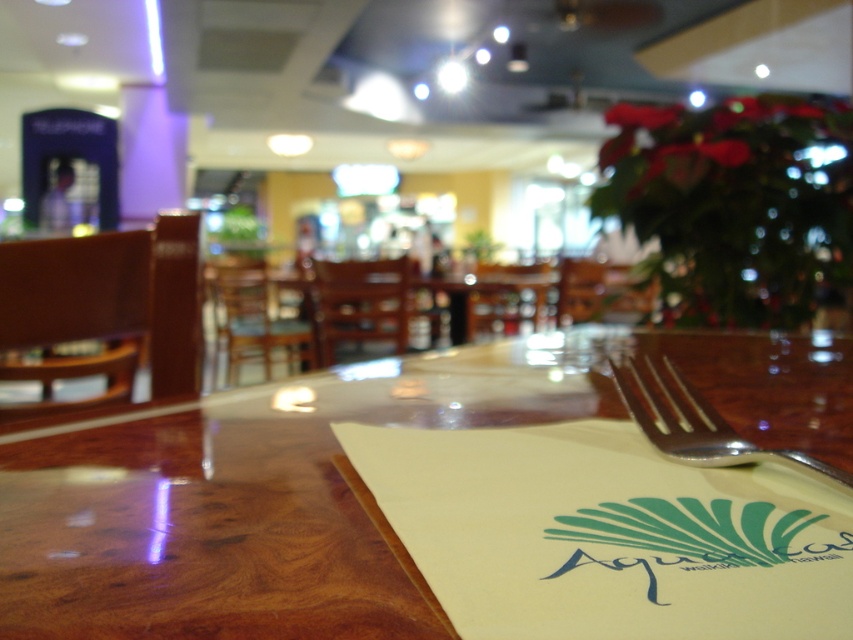
Based on the photo, you are a photographer standing at the camera position. You want to place a small decoration exactly at the point (167, 449). The decoration is 2 inches in diameter. Will it fit without overlapping any existing objects at that point?

The point (167, 449) is 18.12 inches away from the camera. Since the decoration is only 2 inches in diameter, there is sufficient space to place it at that point without overlapping existing objects.

You are a waiter carrying a tray and need to place it on the wooden at center without disturbing the silver metallic fork at lower right. Can you do it?

The wooden at center is located below the silver metallic fork at lower right, so placing the tray on the wooden at center would not disturb the fork since it is positioned lower.

You are a waiter carrying a tray and need to place it on the wooden at center without disturbing the silver metallic fork at lower right. Can you do this?

The wooden at center is in front of the silver metallic fork at lower right, so placing the tray on the wooden at center would not disturb the silver metallic fork at lower right as it is behind it.